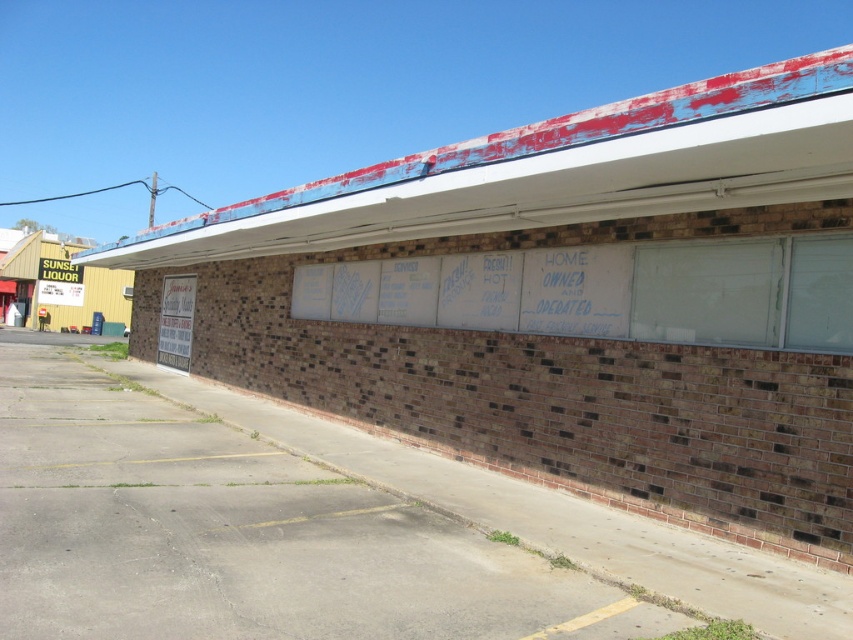
Question: Is white chalkboard at center bigger than white paperboard at center?

Choices:
 (A) yes
 (B) no

Answer: (B)

Question: Which of the following is the farthest from the observer?

Choices:
 (A) pos(590,273)
 (B) pos(193,278)

Answer: (B)

Question: Does white chalkboard at center have a greater width compared to white paperboard at center?

Choices:
 (A) no
 (B) yes

Answer: (A)

Question: Which point is farther to the camera?

Choices:
 (A) white paperboard at center
 (B) white chalkboard at center

Answer: (A)

Question: Is white chalkboard at center positioned before white paperboard at center?

Choices:
 (A) no
 (B) yes

Answer: (B)